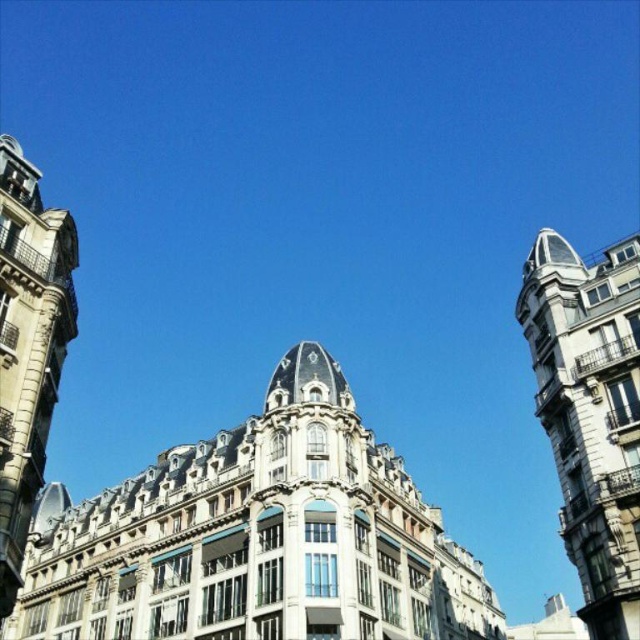
Consider the image. You are an architect analyzing the spatial relationships in this historic urban area. Given the white stone building at center and the stone tower at left, which structure has a greater horizontal extent? Please base your answer on their widths as observed from your viewpoint.

The white stone building at center has a greater horizontal extent because its width surpasses that of the stone tower at left.

You are standing in the historic urban area and see the white stone building at center and the stone tower at left. Which structure is closer to the left edge of the scene?

The stone tower at left is closer to the left edge of the scene because the white stone building at center is positioned on the right side of it.

You are an architect analyzing the layout of this historic urban area. You notice the white stone tower at upper right and the stone tower at left. Which tower would cast a longer shadow during midday if both are of the same height?

The white stone tower at upper right is larger in size than the stone tower at left, so it would cast a longer shadow during midday if both are of the same height.